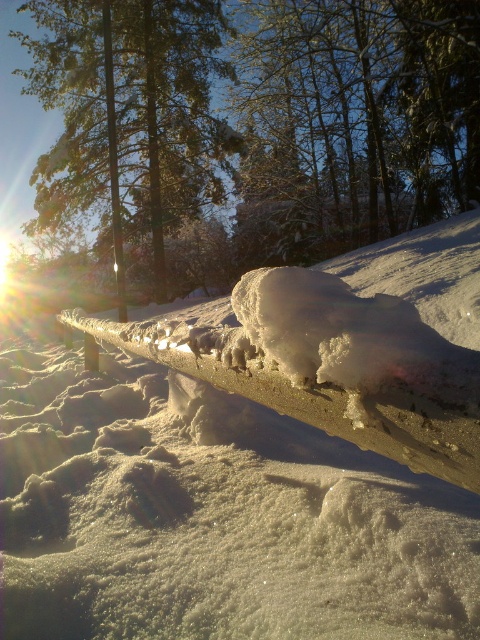
Question: Among these objects, which one is farthest from the camera?

Choices:
 (A) green textured tree at center
 (B) green textured pine tree at upper center
 (C) white frosty snow at center

Answer: (A)

Question: Does white frosty snow at center come in front of green textured tree at center?

Choices:
 (A) no
 (B) yes

Answer: (B)

Question: Which point is closer to the camera?

Choices:
 (A) (186, 403)
 (B) (92, 120)

Answer: (A)

Question: Does white frosty snow at center appear over green textured pine tree at upper center?

Choices:
 (A) yes
 (B) no

Answer: (B)

Question: Is white frosty snow at center below green textured pine tree at upper center?

Choices:
 (A) no
 (B) yes

Answer: (B)

Question: Which of the following is the closest to the observer?

Choices:
 (A) (121, 628)
 (B) (188, 134)
 (C) (415, 44)

Answer: (A)